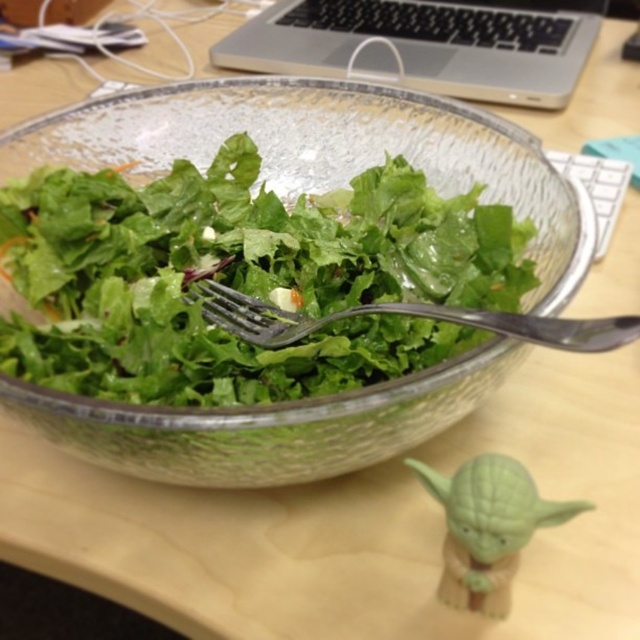
You are holding a camera and want to take a photo of the salad bowl. There is a point at coordinates (84, 307) that is 17.76 centimeters from the camera. Can you focus on the salad bowl while keeping the Yoda figurine in the background?

The point at coordinates (84, 307) is 17.76 centimeters from the camera. Since the salad bowl is the main subject and the Yoda figurine is in the foreground, adjusting the focus to the salad bowl will likely keep the figurine in the background but out of focus. However, the distance provided might help ensure proper focus on the salad bowl.

You are organizing a picnic basket and have both the green leafy salad at center and the silver metallic laptop at upper center. If you want to maximize the number of items you can fit in the basket, which item should you place first?

You should place the silver metallic laptop at upper center first because it occupies more space than the green leafy salad at center, allowing smaller items to fill in the remaining gaps.

You are organizing a picnic and have a silver metallic laptop at upper center and a satin silver fork at center in your backpack. If you take them out and place them on the picnic blanket, which one will you place on top of the other?

The silver metallic laptop at upper center is above the satin silver fork at center, so you should place the silver metallic laptop at upper center on top of the satin silver fork at center.